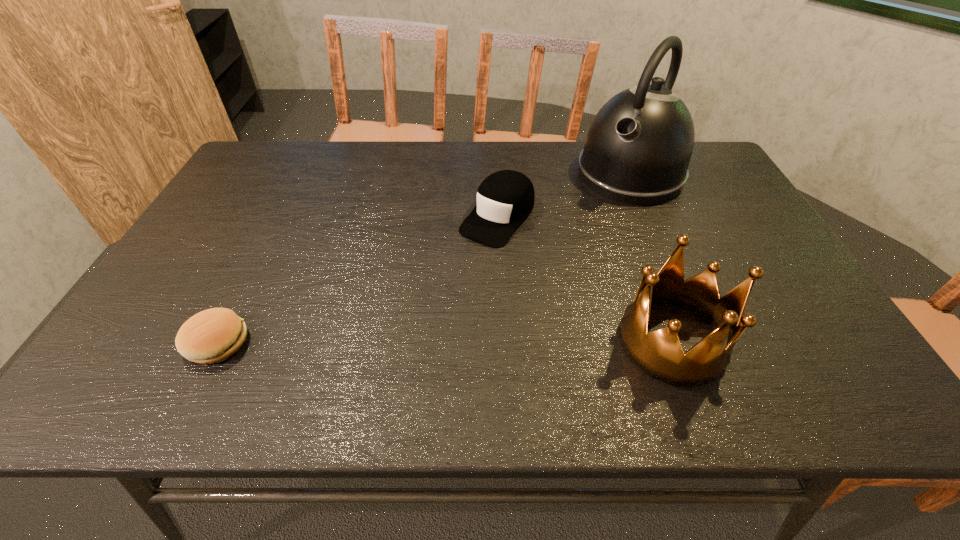
Where is `blank region between the second shortest object and the crown`? This screenshot has width=960, height=540. blank region between the second shortest object and the crown is located at coordinates (585, 279).

Where is `free space between the kettle and the second tallest object`? This screenshot has height=540, width=960. free space between the kettle and the second tallest object is located at coordinates (651, 258).

Find the location of a particular element. Image resolution: width=960 pixels, height=540 pixels. empty space between the second object from left to right and the shortest object is located at coordinates (357, 280).

The image size is (960, 540). What are the coordinates of `vacant space that is in between the patty and the third object from right to left` in the screenshot? It's located at (357, 280).

Where is `vacant space in between the third shortest object and the leftmost object`? This screenshot has width=960, height=540. vacant space in between the third shortest object and the leftmost object is located at coordinates (444, 342).

Locate an element on the screen. This screenshot has height=540, width=960. free space between the tallest object and the patty is located at coordinates (423, 259).

In order to click on object that can be found as the second closest to the second tallest object in this screenshot , I will do `click(638, 148)`.

You are a GUI agent. You are given a task and a screenshot of the screen. Output one action in this format:
    pyautogui.click(x=<x>, y=<y>)
    Task: Click on the object that is the closest to the third object from right to left
    
    Given the screenshot: What is the action you would take?
    pyautogui.click(x=638, y=148)